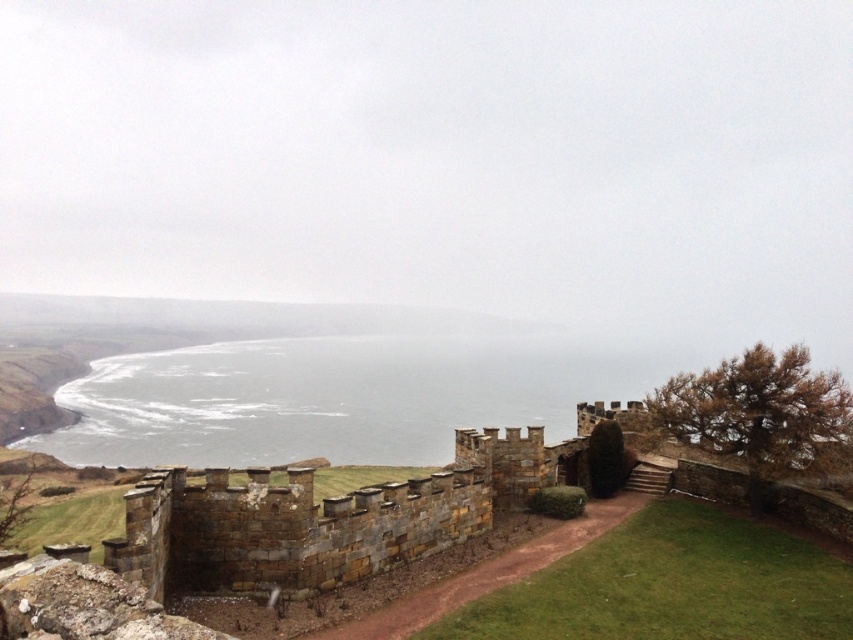
Does gray water at center have a greater height compared to brown stone wall at center?

Yes, gray water at center is taller than brown stone wall at center.

Which is above, gray water at center or brown stone wall at center?

brown stone wall at center is above.

The image size is (853, 640). What do you see at coordinates (331, 397) in the screenshot? I see `gray water at center` at bounding box center [331, 397].

This screenshot has width=853, height=640. I want to click on gray water at center, so click(x=331, y=397).